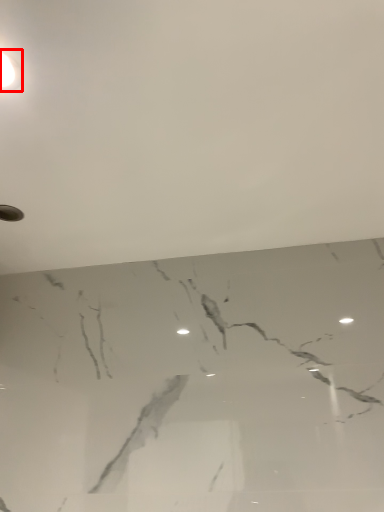
Question: From the image's perspective, what is the correct spatial relationship of lamp (annotated by the red box) in relation to backdrop?

Choices:
 (A) below
 (B) above

Answer: (B)